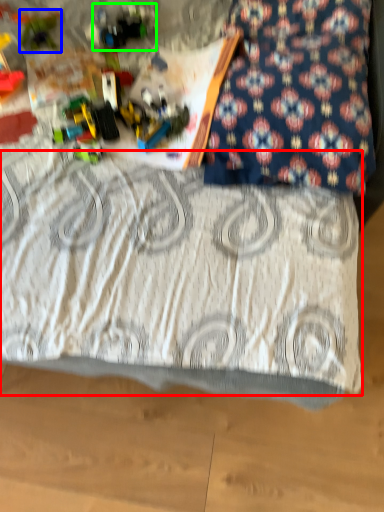
Question: Which object is positioned farthest from bedding (highlighted by a red box)? Select from toy (highlighted by a blue box) and toy (highlighted by a green box).

Choices:
 (A) toy
 (B) toy

Answer: (A)